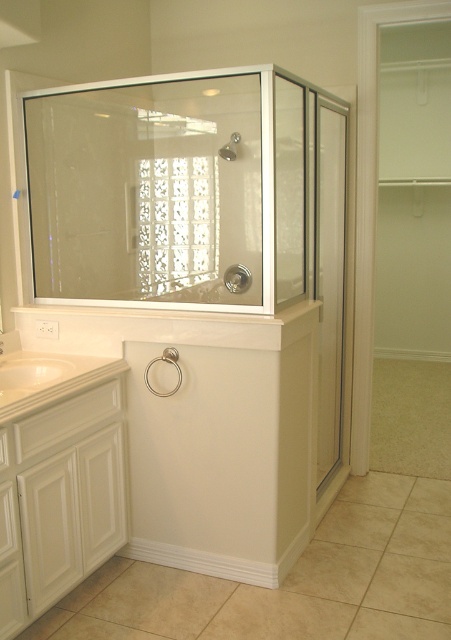
Is clear glass shower at center to the left of white glossy faucet at upper left from the viewer's perspective?

Incorrect, clear glass shower at center is not on the left side of white glossy faucet at upper left.

Between clear glass shower at center and white glossy faucet at upper left, which one appears on the left side from the viewer's perspective?

white glossy faucet at upper left is more to the left.

Who is more forward, (233,136) or (0,340)?

Positioned in front is point (0,340).

Find the location of `clear glass shower at center`. clear glass shower at center is located at coordinates (230, 147).

Is the position of clear glass screen door at right more distant than that of clear glass shower at center?

No, it is in front of clear glass shower at center.

Who is more distant from viewer, (322,170) or (228,144)?

Positioned behind is point (228,144).

The image size is (451, 640). In order to click on clear glass screen door at right in this screenshot , I will do `click(330, 276)`.

Between clear glass screen door at right and white glossy faucet at upper left, which one appears on the left side from the viewer's perspective?

white glossy faucet at upper left

Can you confirm if clear glass screen door at right is positioned to the left of white glossy faucet at upper left?

In fact, clear glass screen door at right is to the right of white glossy faucet at upper left.

Is point (331, 195) positioned after point (3, 342)?

That is True.

Identify the location of clear glass screen door at right. 330,276.